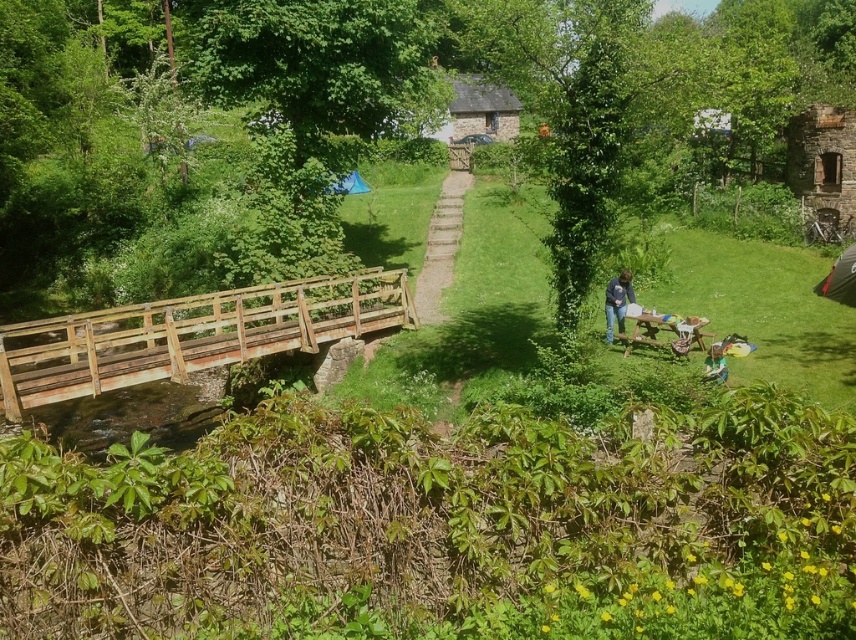
Which is above, wooden bridge at lower left or wooden stairs at center?

wooden stairs at center

Between wooden bridge at lower left and wooden stairs at center, which one is positioned lower?

wooden bridge at lower left

At what (x,y) coordinates should I click in order to perform the action: click on wooden bridge at lower left. Please return your answer as a coordinate pair (x, y). Looking at the image, I should click on pos(191,333).

Is point (449, 252) less distant than point (619, 300)?

No, it is not.

Is wooden stairs at center bigger than blue denim jeans at center?

Indeed, wooden stairs at center has a larger size compared to blue denim jeans at center.

Is point (425, 260) in front of point (629, 300)?

That is False.

At what (x,y) coordinates should I click in order to perform the action: click on wooden stairs at center. Please return your answer as a coordinate pair (x, y). Looking at the image, I should click on (441, 246).

Does wooden bridge at lower left have a smaller size compared to blue denim jeans at center?

Incorrect, wooden bridge at lower left is not smaller in size than blue denim jeans at center.

Is wooden bridge at lower left below blue denim jeans at center?

Yes, wooden bridge at lower left is below blue denim jeans at center.

Who is more forward, (266, 330) or (623, 276)?

Point (623, 276) is more forward.

The height and width of the screenshot is (640, 856). I want to click on wooden bridge at lower left, so click(191, 333).